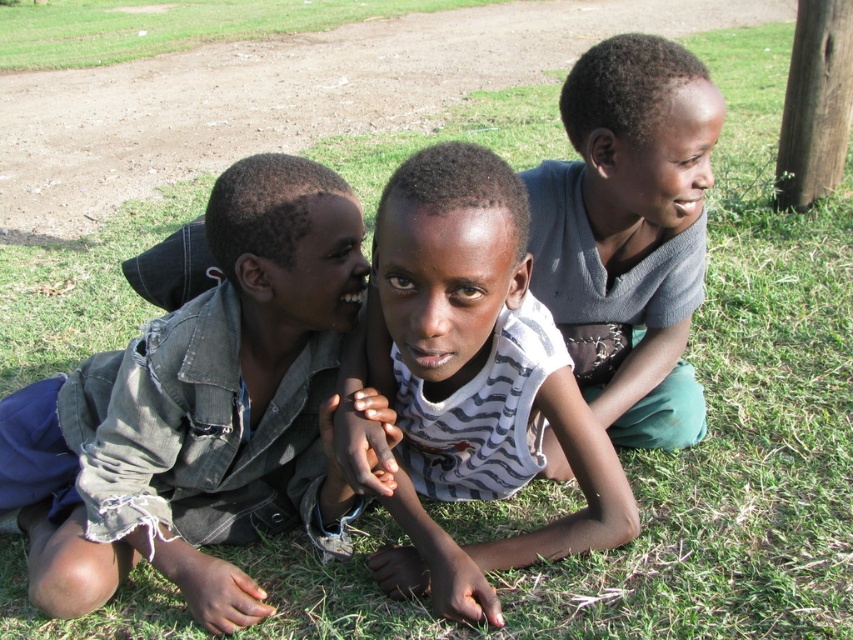
Is ripped denim jacket at center wider than gray matte shirt at upper right?

Correct, the width of ripped denim jacket at center exceeds that of gray matte shirt at upper right.

Is the position of ripped denim jacket at center less distant than that of gray matte shirt at upper right?

Yes.

Image resolution: width=853 pixels, height=640 pixels. Describe the element at coordinates (199, 412) in the screenshot. I see `ripped denim jacket at center` at that location.

The image size is (853, 640). I want to click on ripped denim jacket at center, so click(199, 412).

Is striped fabric shirt at center to the left of gray matte shirt at upper right from the viewer's perspective?

Indeed, striped fabric shirt at center is positioned on the left side of gray matte shirt at upper right.

Which is in front, point (514, 468) or point (589, 259)?

Point (514, 468) is in front.

Does point (422, 467) come farther from viewer compared to point (616, 192)?

Yes, it is behind point (616, 192).

Find the location of a particular element. Image resolution: width=853 pixels, height=640 pixels. striped fabric shirt at center is located at coordinates (476, 372).

Does ripped denim jacket at center appear under striped fabric shirt at center?

Yes, ripped denim jacket at center is below striped fabric shirt at center.

This screenshot has width=853, height=640. What do you see at coordinates (199, 412) in the screenshot? I see `ripped denim jacket at center` at bounding box center [199, 412].

At what (x,y) coordinates should I click in order to perform the action: click on ripped denim jacket at center. Please return your answer as a coordinate pair (x, y). Looking at the image, I should click on (199, 412).